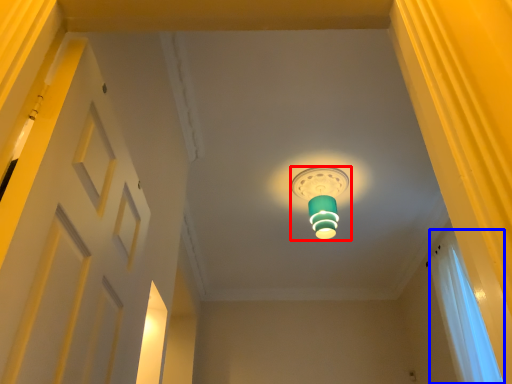
Question: Which of the following is the farthest to the observer, lamp (highlighted by a red box) or curtain (highlighted by a blue box)?

Choices:
 (A) lamp
 (B) curtain

Answer: (A)